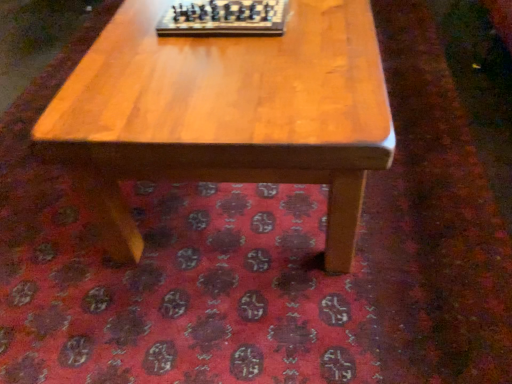
The height and width of the screenshot is (384, 512). Identify the location of light brown wood coffee table at center. (225, 114).

The width and height of the screenshot is (512, 384). Describe the element at coordinates (225, 114) in the screenshot. I see `light brown wood coffee table at center` at that location.

Measure the distance between point (136, 67) and camera.

Point (136, 67) is 3.64 feet away from camera.

Image resolution: width=512 pixels, height=384 pixels. What do you see at coordinates (224, 18) in the screenshot? I see `wooden chessboard at center` at bounding box center [224, 18].

What is the approximate width of wooden chessboard at center?

wooden chessboard at center is 14.98 inches wide.

This screenshot has height=384, width=512. Identify the location of wooden chessboard at center. (224, 18).

Measure the distance between wooden chessboard at center and camera.

The distance of wooden chessboard at center from camera is 1.19 meters.

From the picture: Measure the distance between point (243,8) and camera.

Point (243,8) is 3.98 feet from camera.

This screenshot has height=384, width=512. I want to click on light brown wood coffee table at center, so click(x=225, y=114).

Considering the relative positions of wooden chessboard at center and light brown wood coffee table at center in the image provided, is wooden chessboard at center to the right of light brown wood coffee table at center from the viewer's perspective?

Incorrect, wooden chessboard at center is not on the right side of light brown wood coffee table at center.

Consider the image. Is wooden chessboard at center closer to camera compared to light brown wood coffee table at center?

No, the depth of wooden chessboard at center is greater than that of light brown wood coffee table at center.

Does point (179, 25) come closer to viewer compared to point (321, 39)?

No, it is behind (321, 39).

From the image's perspective, is wooden chessboard at center above or below light brown wood coffee table at center?

wooden chessboard at center is situated higher than light brown wood coffee table at center in the image.

From a real-world perspective, is wooden chessboard at center above or below light brown wood coffee table at center?

Clearly, from a real-world perspective, wooden chessboard at center is above light brown wood coffee table at center.

From the picture: Considering the relative sizes of wooden chessboard at center and light brown wood coffee table at center in the image provided, is wooden chessboard at center thinner than light brown wood coffee table at center?

Correct, the width of wooden chessboard at center is less than that of light brown wood coffee table at center.

Who is shorter, wooden chessboard at center or light brown wood coffee table at center?

wooden chessboard at center is shorter.

Considering the sizes of objects wooden chessboard at center and light brown wood coffee table at center in the image provided, who is smaller, wooden chessboard at center or light brown wood coffee table at center?

With smaller size is wooden chessboard at center.

Could light brown wood coffee table at center be considered to be inside wooden chessboard at center?

No, light brown wood coffee table at center is located outside of wooden chessboard at center.

Consider the image. Is wooden chessboard at center not near light brown wood coffee table at center?

No, wooden chessboard at center is in close proximity to light brown wood coffee table at center.

Is wooden chessboard at center positioned with its back to light brown wood coffee table at center?

wooden chessboard at center does not have its back to light brown wood coffee table at center.

At what (x,y) coordinates should I click in order to perform the action: click on board game behind the light brown wood coffee table at center. Please return your answer as a coordinate pair (x, y). Looking at the image, I should click on (224, 18).

Does light brown wood coffee table at center appear on the right side of wooden chessboard at center?

Yes.

Is light brown wood coffee table at center in front of wooden chessboard at center?

Yes, light brown wood coffee table at center is in front of wooden chessboard at center.

Is point (354, 122) less distant than point (188, 16)?

Yes, it is.

From the image's perspective, which one is positioned lower, light brown wood coffee table at center or wooden chessboard at center?

light brown wood coffee table at center is shown below in the image.

From a real-world perspective, is light brown wood coffee table at center physically above wooden chessboard at center?

Incorrect, from a real-world perspective, light brown wood coffee table at center is lower than wooden chessboard at center.

Which object is wider, light brown wood coffee table at center or wooden chessboard at center?

Wider between the two is light brown wood coffee table at center.

From their relative heights in the image, would you say light brown wood coffee table at center is taller or shorter than wooden chessboard at center?

In the image, light brown wood coffee table at center appears to be taller than wooden chessboard at center.

Looking at this image, considering the sizes of objects light brown wood coffee table at center and wooden chessboard at center in the image provided, who is bigger, light brown wood coffee table at center or wooden chessboard at center?

With larger size is light brown wood coffee table at center.

Would you say light brown wood coffee table at center is inside or outside wooden chessboard at center?

The correct answer is: outside.

In the scene shown: Is light brown wood coffee table at center not near wooden chessboard at center?

No, there isn't a large distance between light brown wood coffee table at center and wooden chessboard at center.

Could you tell me if light brown wood coffee table at center is turned towards wooden chessboard at center?

No, light brown wood coffee table at center is not facing towards wooden chessboard at center.

What's the angular difference between light brown wood coffee table at center and wooden chessboard at center's facing directions?

1.49 degrees separate the facing orientations of light brown wood coffee table at center and wooden chessboard at center.

I want to click on board game on the left of light brown wood coffee table at center, so click(224, 18).

You are a GUI agent. You are given a task and a screenshot of the screen. Output one action in this format:
    pyautogui.click(x=<x>, y=<y>)
    Task: Click on the coffee table below the wooden chessboard at center (from the image's perspective)
    The height and width of the screenshot is (384, 512).
    Given the screenshot: What is the action you would take?
    pyautogui.click(x=225, y=114)

Image resolution: width=512 pixels, height=384 pixels. Find the location of `board game above the light brown wood coffee table at center (from a real-world perspective)`. board game above the light brown wood coffee table at center (from a real-world perspective) is located at coordinates (224, 18).